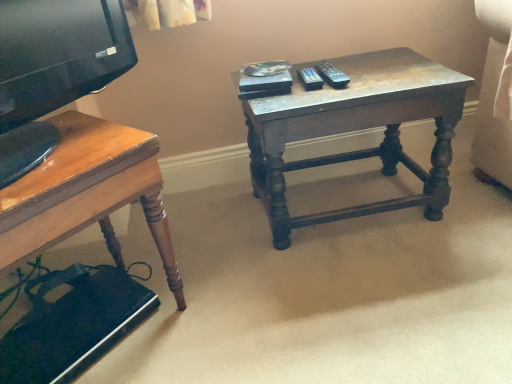
At what (x,y) coordinates should I click in order to perform the action: click on vacant space in between wooden desk at lower left and distressed wood table at center. Please return your answer as a coordinate pair (x, y). The height and width of the screenshot is (384, 512). Looking at the image, I should click on (253, 273).